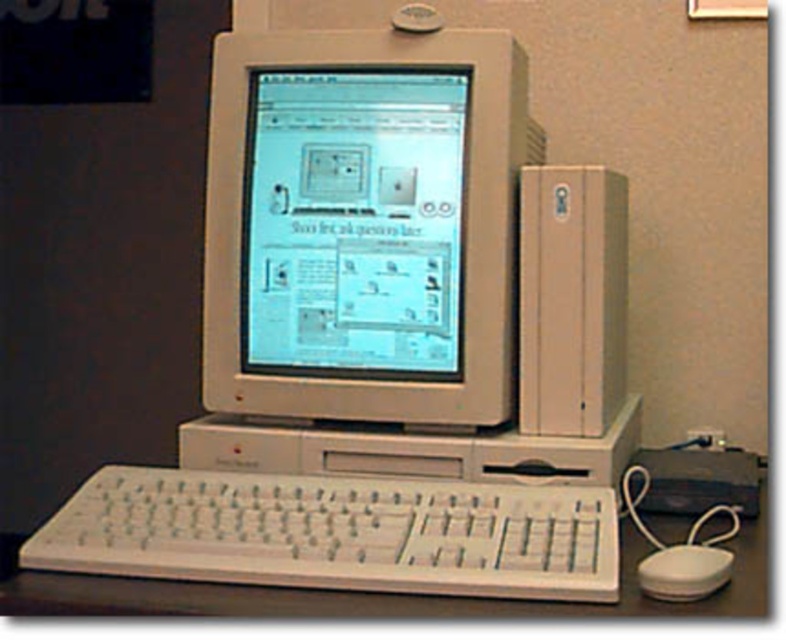
Consider the image. You are a technician trying to connect a mouse to the vintage computer setup. The mouse has a USB port, but the computer only has a PS2 port. You see the white plastic keyboard at lower center. Can you use the keyboard to help connect the mouse?

No, the white plastic keyboard at lower center cannot help connect the mouse since it is located at point (x=336, y=532), which is unrelated to the ports available on the computer.

You are setting up a desk and need to place the white plastic monitor at center and the white plastic mouse at lower right. Given their sizes, which object requires more horizontal space on the desk?

The white plastic monitor at center requires more horizontal space on the desk because its width surpasses that of the white plastic mouse at lower right.